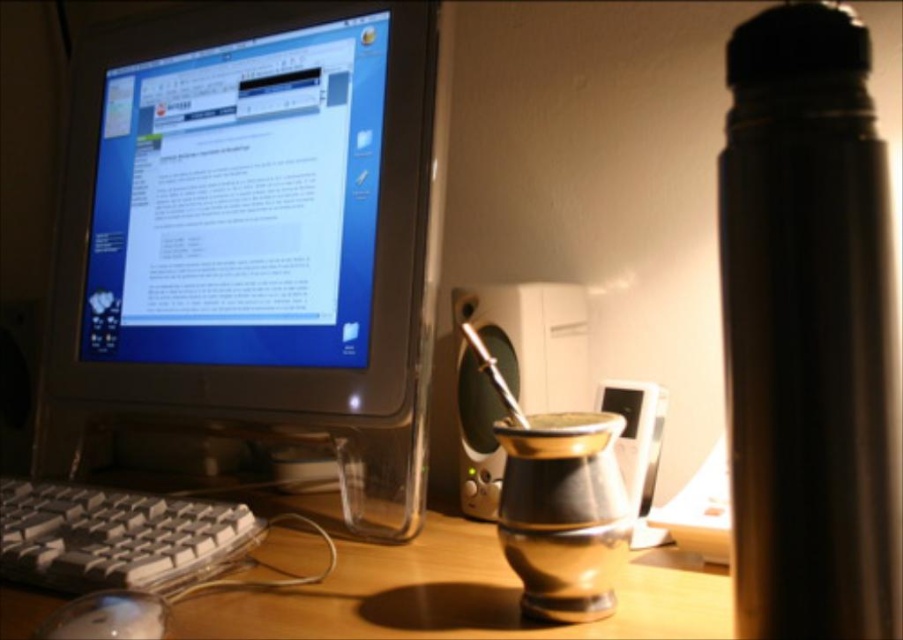
Between matte plastic monitor at upper left and white plastic mouse at lower left, which one appears on the left side from the viewer's perspective?

Positioned to the left is matte plastic monitor at upper left.

Between matte plastic monitor at upper left and white plastic mouse at lower left, which one has more height?

With more height is matte plastic monitor at upper left.

Between point (105, 124) and point (98, 592), which one is positioned behind?

Point (105, 124)

This screenshot has height=640, width=903. Identify the location of matte plastic monitor at upper left. (247, 209).

Is point (389, 556) positioned before point (182, 550)?

No, it is behind (182, 550).

How much distance is there between metallic brass gourd at center and white plastic keyboard at lower left?

metallic brass gourd at center is 4.66 inches from white plastic keyboard at lower left.

Describe the element at coordinates (448, 592) in the screenshot. I see `metallic brass gourd at center` at that location.

Where is `metallic brass gourd at center`? The image size is (903, 640). metallic brass gourd at center is located at coordinates (448, 592).

Does matte plastic monitor at upper left have a greater height compared to white plastic keyboard at lower left?

Indeed, matte plastic monitor at upper left has a greater height compared to white plastic keyboard at lower left.

Between matte plastic monitor at upper left and white plastic keyboard at lower left, which one has less height?

white plastic keyboard at lower left

Which is behind, point (154, 65) or point (166, 528)?

Point (154, 65)

Image resolution: width=903 pixels, height=640 pixels. In order to click on matte plastic monitor at upper left in this screenshot , I will do `click(247, 209)`.